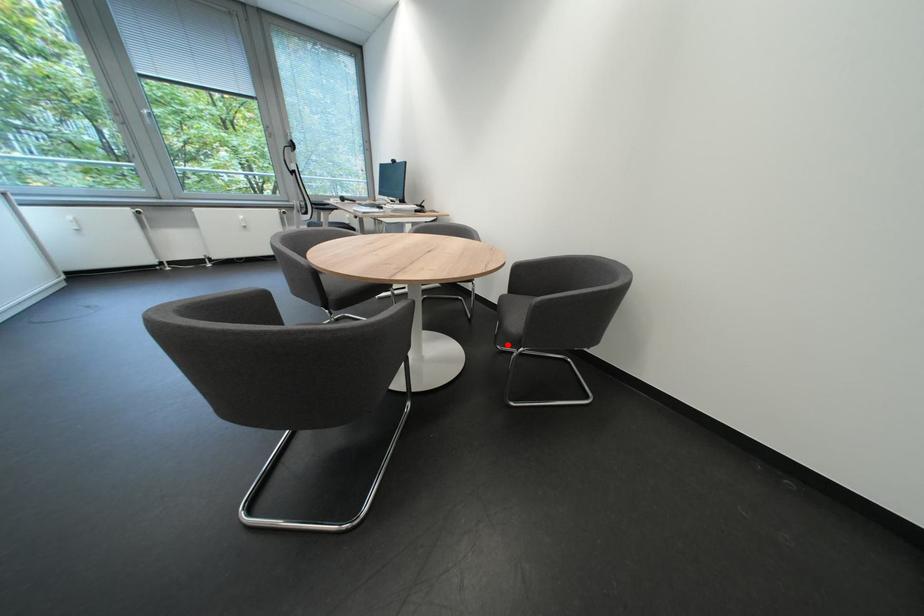
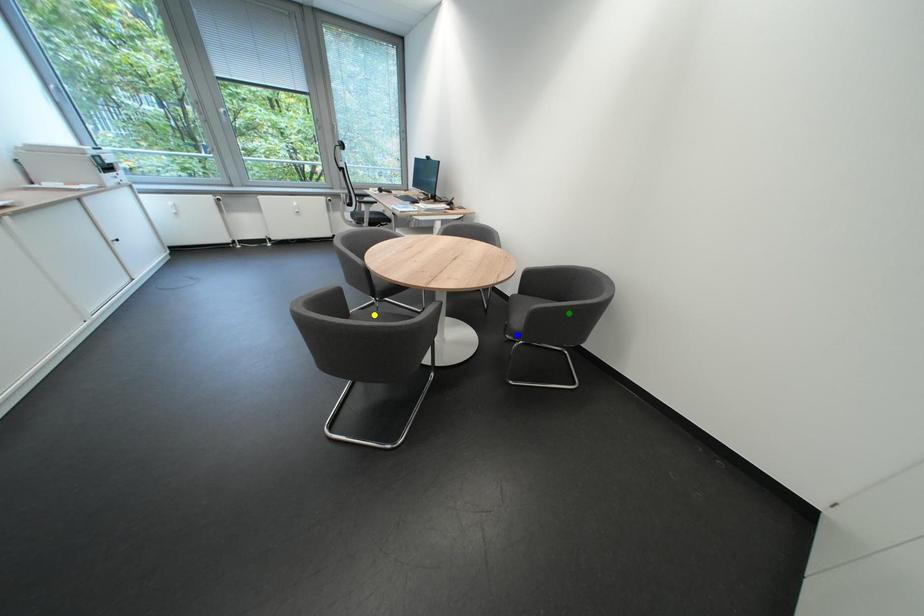
Question: I am providing you with two images of the same scene from different viewpoints. A red point is marked on the first image. You are given multiple points on the second image. Which point in image 2 represents the same 3d spot as the red point in image 1?

Choices:
 (A) green point
 (B) blue point
 (C) yellow point

Answer: (B)